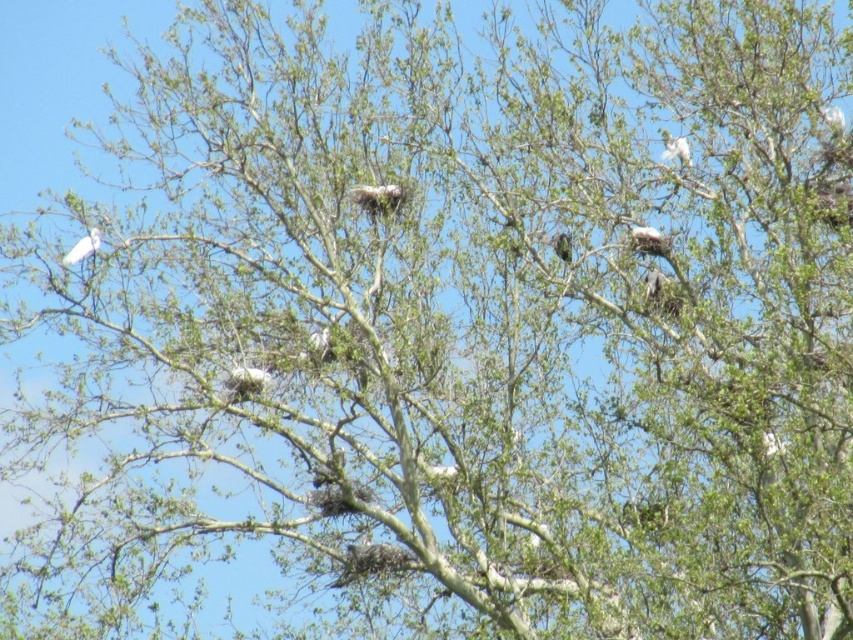
In the scene shown: Does white fluffy nest at upper right have a greater height compared to white fluffy bird at upper right?

No, white fluffy nest at upper right is not taller than white fluffy bird at upper right.

Between white fluffy nest at upper right and white fluffy bird at upper right, which one has less height?

white fluffy nest at upper right

Does point (669, 240) come in front of point (672, 138)?

Yes, point (669, 240) is in front of point (672, 138).

Where is `white fluffy nest at upper right`? white fluffy nest at upper right is located at coordinates (648, 241).

Is point (94, 240) less distant than point (569, 252)?

Yes, it is.

Does white feathered bird at upper left appear on the left side of green textured bird at center?

Indeed, white feathered bird at upper left is positioned on the left side of green textured bird at center.

This screenshot has width=853, height=640. What are the coordinates of `white feathered bird at upper left` in the screenshot? It's located at (83, 248).

Is white fluffy nest at center smaller than white fluffy bird at upper right?

No, white fluffy nest at center is not smaller than white fluffy bird at upper right.

Is white fluffy nest at center below white fluffy bird at upper right?

Yes.

What do you see at coordinates (247, 381) in the screenshot?
I see `white fluffy nest at center` at bounding box center [247, 381].

The height and width of the screenshot is (640, 853). Identify the location of white fluffy nest at center. (247, 381).